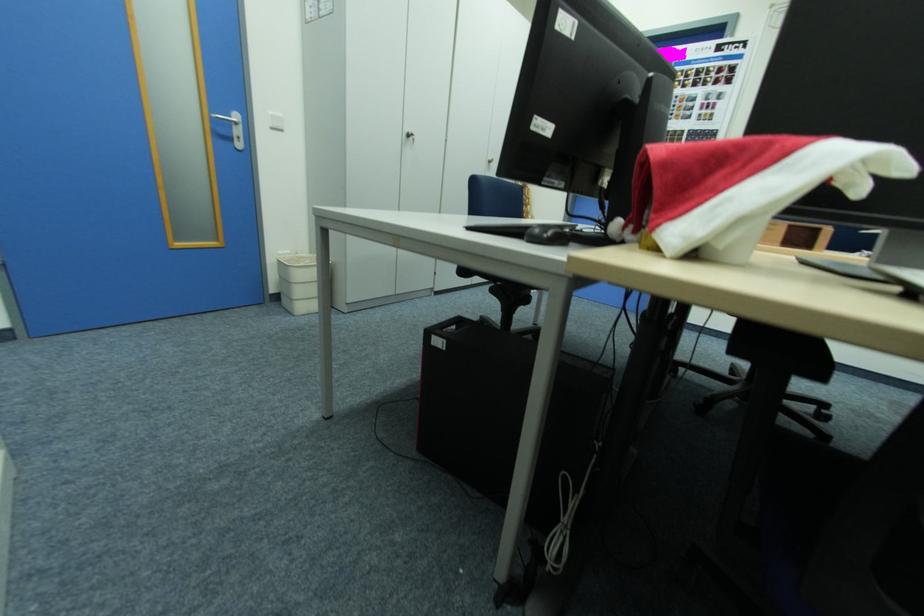
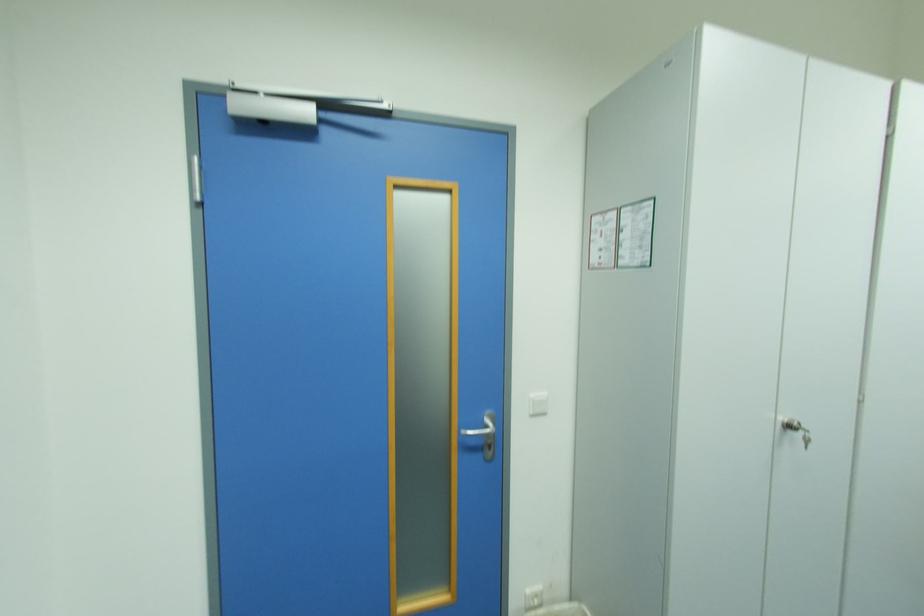
Locate, in the second image, the point that corresponds to [286,254] in the first image.

(535, 592)